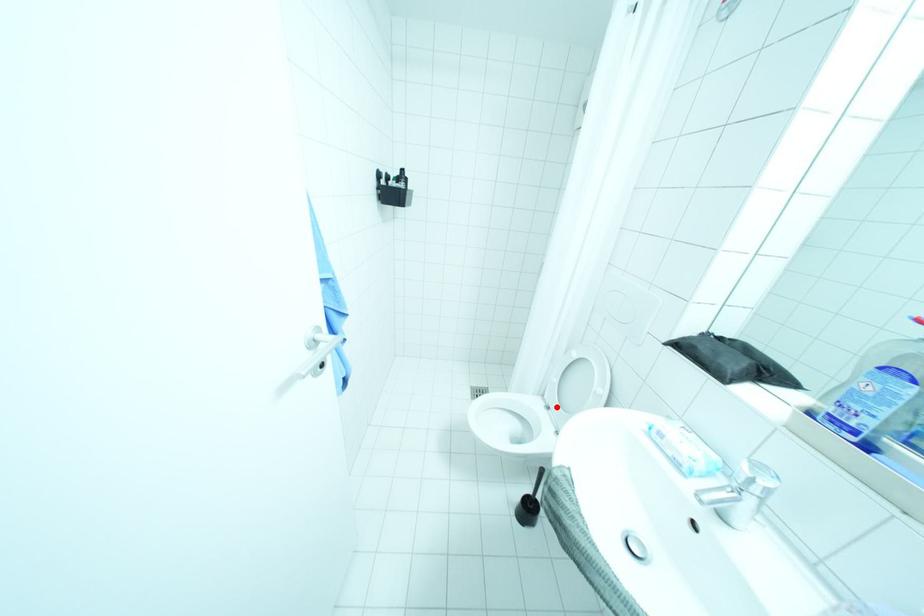
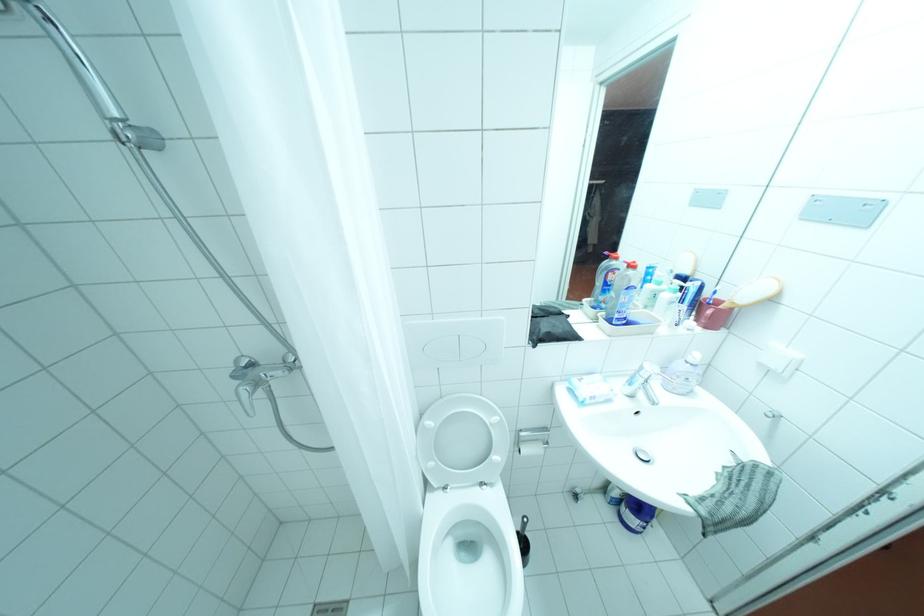
In the second image, find the point that corresponds to the highlighted location in the first image.

(455, 487)